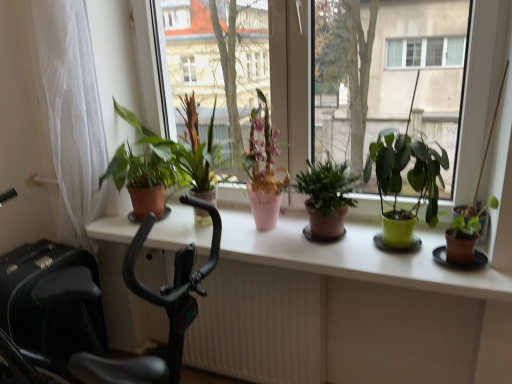
Question: Is white sheer curtain at left wider than green matte plant at center, the 3th houseplant viewed from the left?

Choices:
 (A) yes
 (B) no

Answer: (B)

Question: Is white sheer curtain at left positioned with its back to green matte plant at center, the 3th houseplant from the right?

Choices:
 (A) yes
 (B) no

Answer: (B)

Question: From the image's perspective, is white sheer curtain at left on top of green matte plant at center, the 3th houseplant from the right?

Choices:
 (A) no
 (B) yes

Answer: (B)

Question: Are white sheer curtain at left and green matte plant at center, the 3th houseplant from the right, beside each other?

Choices:
 (A) yes
 (B) no

Answer: (B)

Question: Does white sheer curtain at left have a lesser height compared to green matte plant at center, the 3th houseplant from the right?

Choices:
 (A) yes
 (B) no

Answer: (B)

Question: Is white sheer curtain at left in front of green matte plant at center, the 3th houseplant from the right?

Choices:
 (A) no
 (B) yes

Answer: (A)

Question: From the image's perspective, is pink ceramic vase at center, which is the 4th houseplant from right to left, located above white textured radiator at lower center?

Choices:
 (A) no
 (B) yes

Answer: (B)

Question: From a real-world perspective, is pink ceramic vase at center, which is the 4th houseplant from right to left, located higher than white textured radiator at lower center?

Choices:
 (A) no
 (B) yes

Answer: (B)

Question: Is pink ceramic vase at center, which ranks as the 2th houseplant in left-to-right order, beside white textured radiator at lower center?

Choices:
 (A) yes
 (B) no

Answer: (B)

Question: Is pink ceramic vase at center, which is the 4th houseplant from right to left, not near white textured radiator at lower center?

Choices:
 (A) yes
 (B) no

Answer: (B)

Question: Would you say pink ceramic vase at center, which ranks as the 2th houseplant in left-to-right order, contains white textured radiator at lower center?

Choices:
 (A) no
 (B) yes

Answer: (A)

Question: Considering the relative sizes of pink ceramic vase at center, which is the 4th houseplant from right to left, and white textured radiator at lower center in the image provided, is pink ceramic vase at center, which is the 4th houseplant from right to left, wider than white textured radiator at lower center?

Choices:
 (A) no
 (B) yes

Answer: (B)

Question: Can you confirm if brown matte pot at right, arranged as the fifth houseplant when viewed from the left, is thinner than green matte plant pot at center?

Choices:
 (A) yes
 (B) no

Answer: (B)